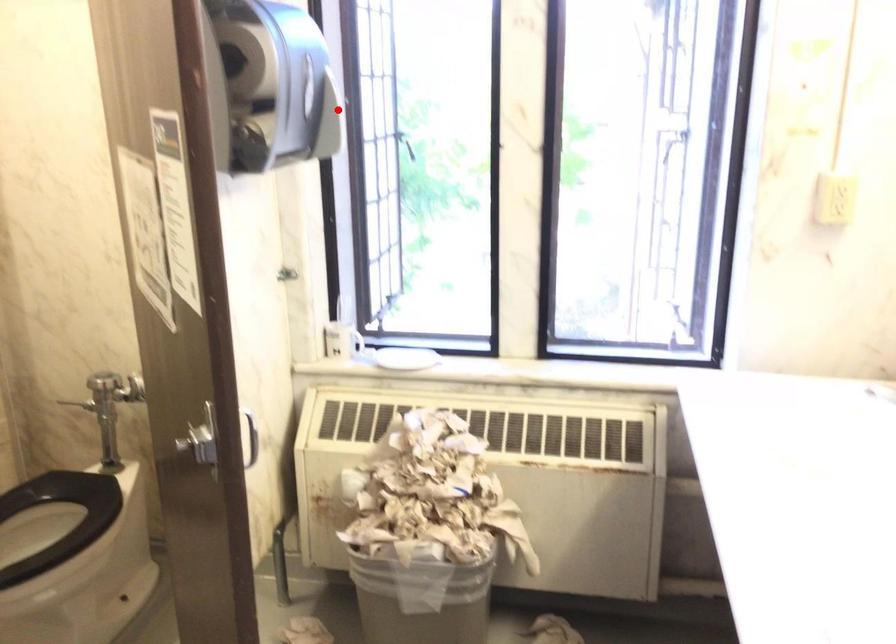
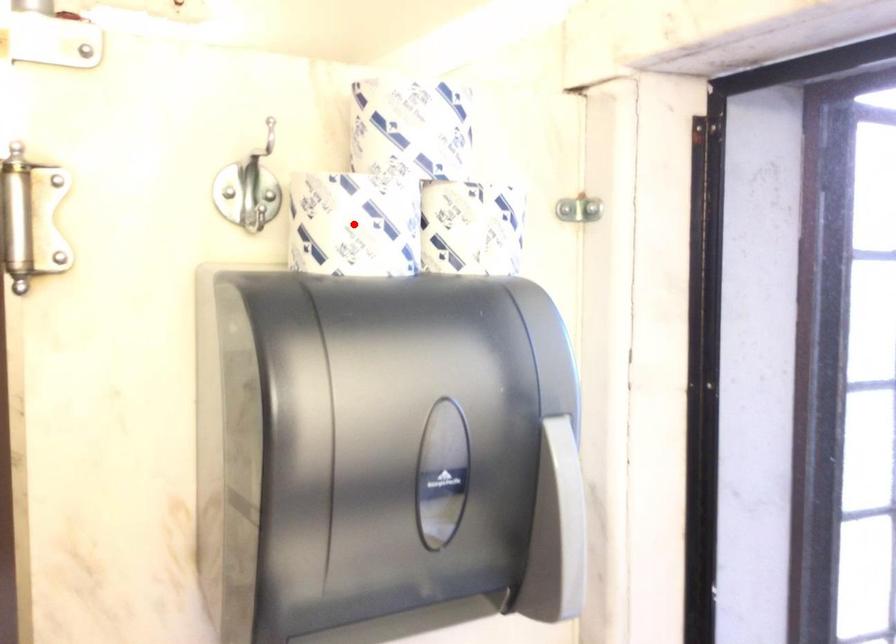
I am providing you with two images of the same scene from different viewpoints. A red point is marked on the first image and another point is marked on the second image. Are the points marked in image1 and image2 representing the same 3D position?

No